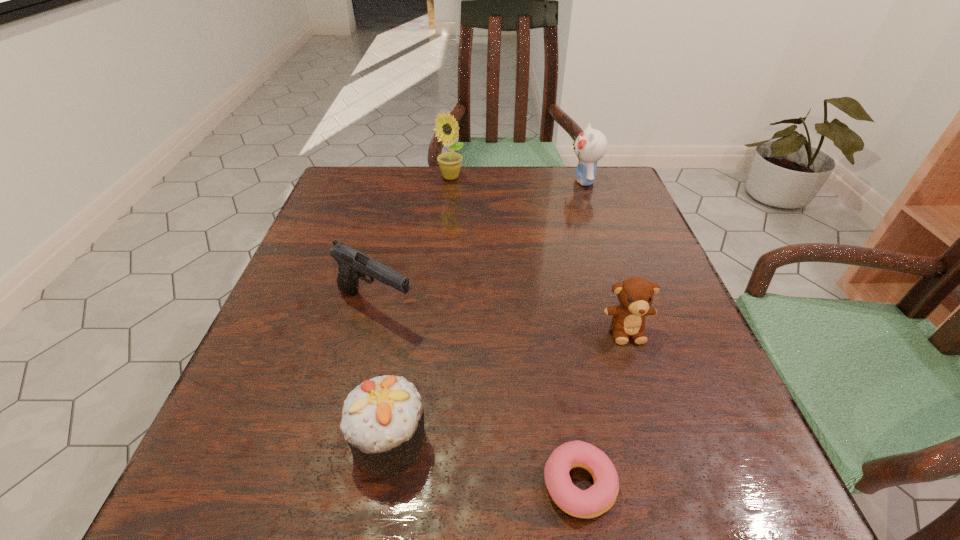
Where is `kitten that is at the right edge`? Image resolution: width=960 pixels, height=540 pixels. kitten that is at the right edge is located at coordinates [x=590, y=146].

This screenshot has width=960, height=540. Identify the location of teddy bear located in the right edge section of the desktop. (635, 294).

This screenshot has width=960, height=540. I want to click on object that is at the far right corner, so click(x=590, y=146).

This screenshot has height=540, width=960. Identify the location of vacant area at the far edge. (442, 208).

Locate an element on the screen. This screenshot has width=960, height=540. vacant space at the left edge of the desktop is located at coordinates (324, 286).

Where is `vacant region at the right edge of the desktop`? vacant region at the right edge of the desktop is located at coordinates (670, 305).

The image size is (960, 540). What are the coordinates of `vacant space at the far left corner of the desktop` in the screenshot? It's located at (319, 213).

Locate an element on the screen. free location at the near left corner is located at coordinates (198, 482).

At what (x,y) coordinates should I click in order to perform the action: click on vacant space at the far right corner. Please return your answer as a coordinate pair (x, y). Looking at the image, I should click on (622, 186).

Where is `vacant space at the near right corner`? vacant space at the near right corner is located at coordinates (660, 464).